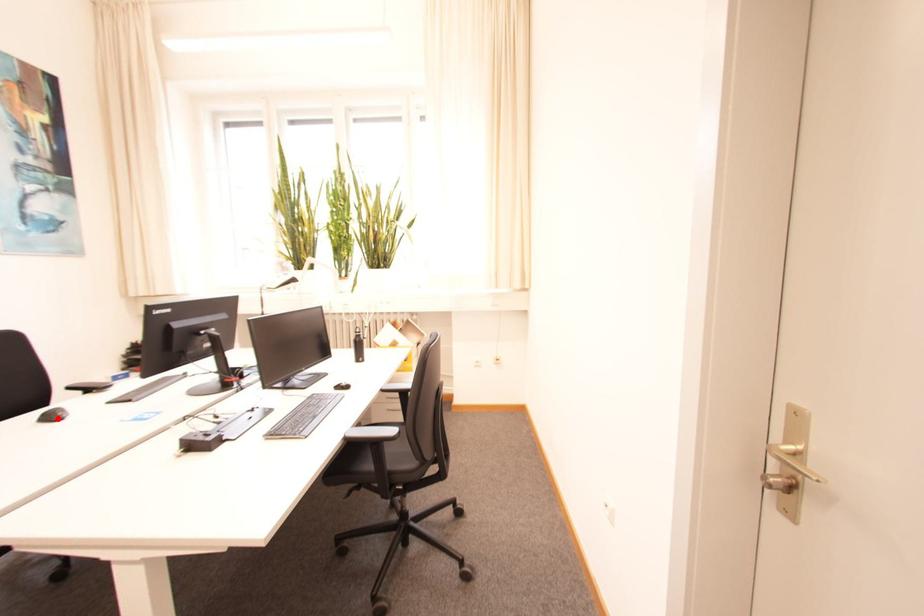
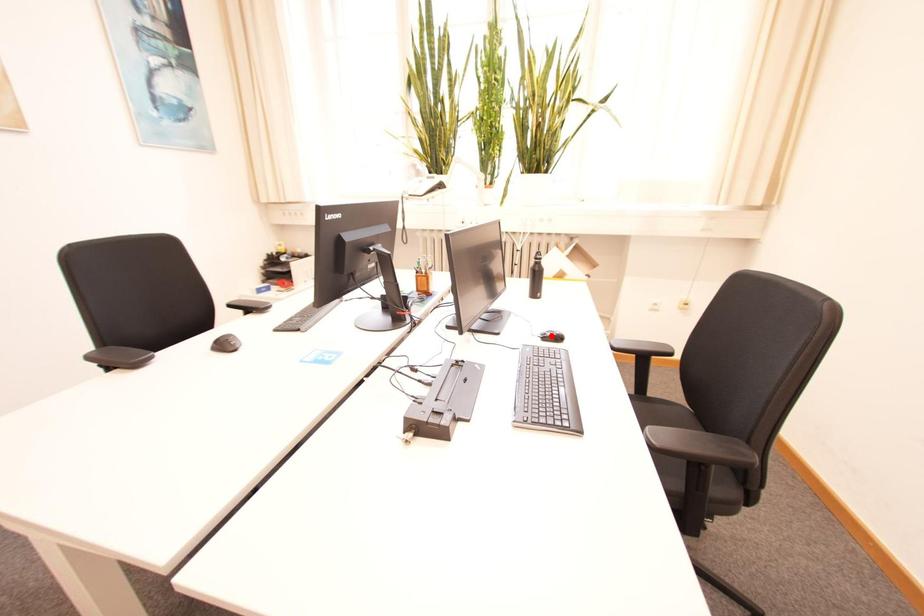
I am providing you with two images of the same scene from different viewpoints. A red point is marked on the first image and another point is marked on the second image. Is the red point in image1 aligned with the point shown in image2?

No